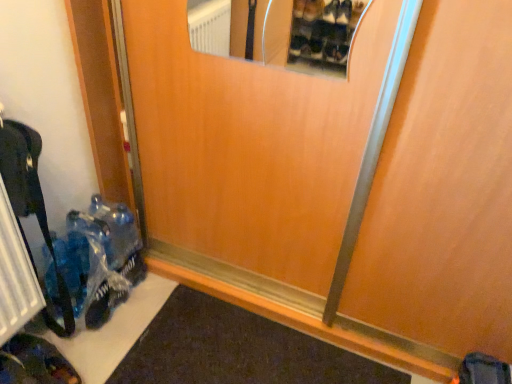
Question: From the image's perspective, is black metal radiator at lower left under wooden door at center?

Choices:
 (A) no
 (B) yes

Answer: (B)

Question: Is black metal radiator at lower left oriented towards wooden door at center?

Choices:
 (A) no
 (B) yes

Answer: (A)

Question: Can you confirm if black metal radiator at lower left is thinner than wooden door at center?

Choices:
 (A) yes
 (B) no

Answer: (A)

Question: Considering the relative sizes of black metal radiator at lower left and wooden door at center in the image provided, is black metal radiator at lower left smaller than wooden door at center?

Choices:
 (A) yes
 (B) no

Answer: (A)

Question: Would you say wooden door at center is part of black metal radiator at lower left's contents?

Choices:
 (A) no
 (B) yes

Answer: (A)

Question: From the image's perspective, is black metal radiator at lower left located above or below wooden door at center?

Choices:
 (A) below
 (B) above

Answer: (A)

Question: From a real-world perspective, is black metal radiator at lower left physically located above or below wooden door at center?

Choices:
 (A) below
 (B) above

Answer: (A)

Question: In the image, is black metal radiator at lower left positioned in front of or behind wooden door at center?

Choices:
 (A) front
 (B) behind

Answer: (B)

Question: Is black metal radiator at lower left to the left or to the right of wooden door at center in the image?

Choices:
 (A) right
 (B) left

Answer: (B)

Question: Does point (285, 205) appear closer or farther from the camera than point (76, 286)?

Choices:
 (A) closer
 (B) farther

Answer: (A)

Question: From a real-world perspective, is wooden door at center positioned above or below translucent plastic bag at lower left?

Choices:
 (A) above
 (B) below

Answer: (A)

Question: Considering the relative positions of wooden door at center and translucent plastic bag at lower left in the image provided, is wooden door at center to the left or to the right of translucent plastic bag at lower left?

Choices:
 (A) left
 (B) right

Answer: (B)

Question: From the image's perspective, is wooden door at center above or below translucent plastic bag at lower left?

Choices:
 (A) below
 (B) above

Answer: (B)

Question: Would you say dark brown leather shoe at lower left is to the left or to the right of translucent plastic bag at lower left in the picture?

Choices:
 (A) right
 (B) left

Answer: (B)

Question: Is dark brown leather shoe at lower left wider or thinner than translucent plastic bag at lower left?

Choices:
 (A) wide
 (B) thin

Answer: (A)